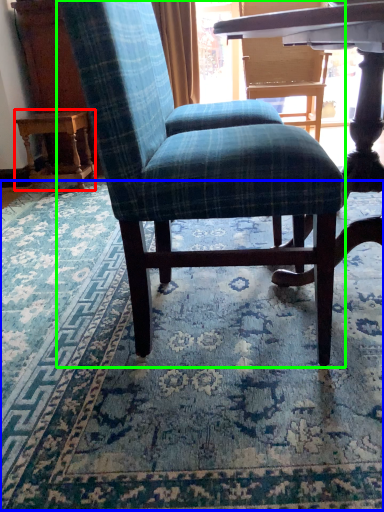
Question: Considering the real-world distances, which object is closest to table (highlighted by a red box)? mat (highlighted by a blue box) or chair (highlighted by a green box).

Choices:
 (A) mat
 (B) chair

Answer: (A)